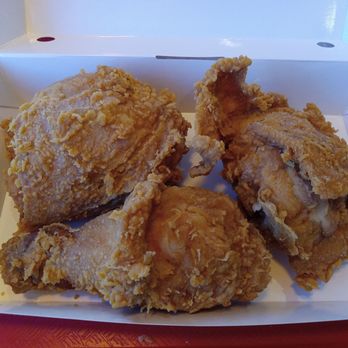
Find the location of a particular element. plate is located at coordinates (268, 311).